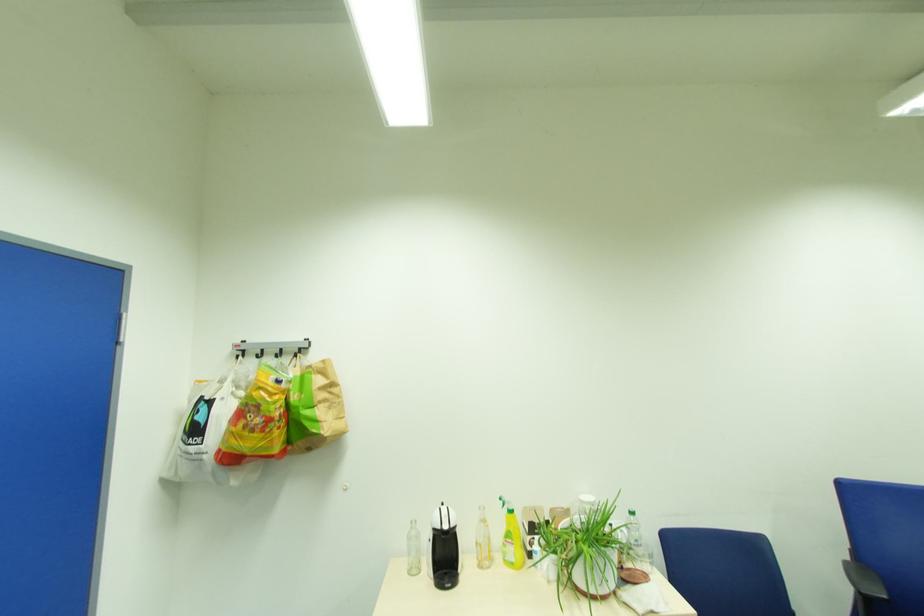
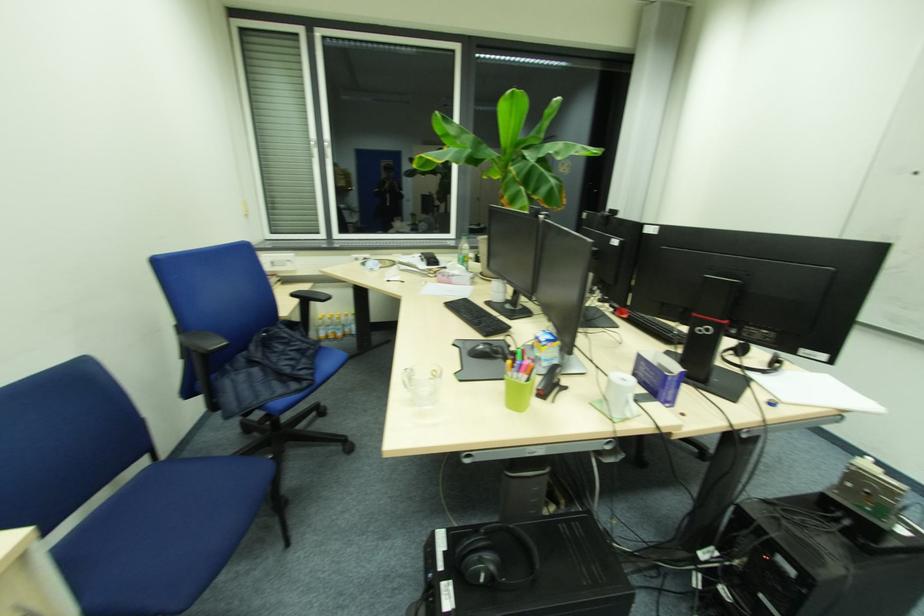
How did the camera likely rotate?

The camera's rotation is toward right-down.